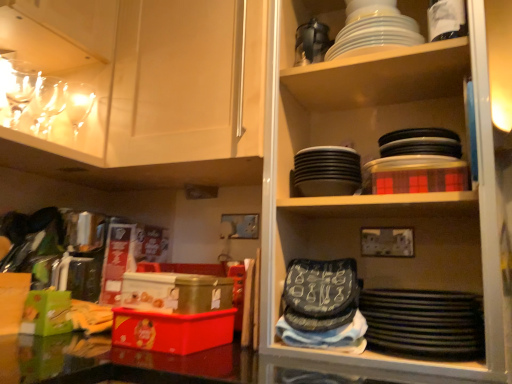
Question: Looking at their shapes, would you say clear glass wine glasses at upper left, which ranks as the first tableware in left-to-right order, is wider or thinner than matte white cabinet at upper left?

Choices:
 (A) wide
 (B) thin

Answer: (B)

Question: From the image's perspective, is clear glass wine glasses at upper left, marked as the fourth tableware in a right-to-left arrangement, positioned above or below matte white cabinet at upper left?

Choices:
 (A) below
 (B) above

Answer: (A)

Question: Which object is the farthest from the clear glass wine glasses at upper left, marked as the fourth tableware in a right-to-left arrangement?

Choices:
 (A) matte white cabinet at upper left
 (B) white glossy plates at upper center, positioned as the 4th tableware in left-to-right order
 (C) matte plastic box at lower left
 (D) black matte platter at lower right
 (E) black matte plates at upper right

Answer: (D)

Question: Based on their relative distances, which object is nearer to the matte white cabinet at upper left?

Choices:
 (A) black matte plates at upper center, positioned as the 2th tableware in right-to-left order
 (B) matte plastic box at lower left
 (C) black matte platter at lower right
 (D) white glossy plates at upper center, the 1th tableware positioned from the right
 (E) black matte plates at upper right

Answer: (E)